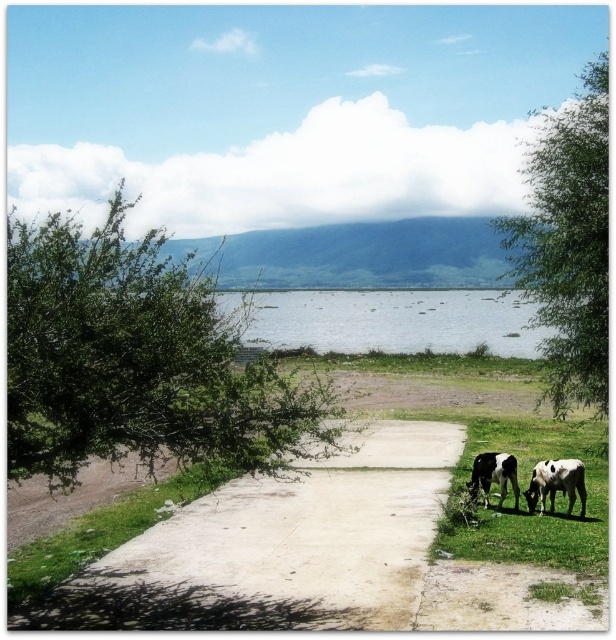
This screenshot has height=640, width=616. In order to click on green leafy tree at left in this screenshot , I will do `click(137, 360)`.

Is point (148, 352) positioned in front of point (583, 80)?

Yes, point (148, 352) is in front of point (583, 80).

This screenshot has height=640, width=616. What are the coordinates of `green leafy tree at left` in the screenshot? It's located at (137, 360).

Is green grass at lower right positioned in front of black and white spotted cow at lower right?

Yes, green grass at lower right is in front of black and white spotted cow at lower right.

Which of these two, green grass at lower right or black and white spotted cow at lower right, stands shorter?

With less height is green grass at lower right.

Between point (503, 515) and point (540, 481), which one is positioned behind?

The point (540, 481) is behind.

I want to click on green grass at lower right, so click(x=525, y=500).

Can you confirm if green leafy tree at right is positioned to the right of black and white spotted cow at lower right?

Correct, you'll find green leafy tree at right to the right of black and white spotted cow at lower right.

Between green leafy tree at right and black and white spotted cow at lower right, which one has less height?

With less height is black and white spotted cow at lower right.

Between point (607, 198) and point (543, 476), which one is positioned in front?

Point (607, 198) is in front.

Where is `green leafy tree at right`? The height and width of the screenshot is (640, 616). green leafy tree at right is located at coordinates (569, 243).